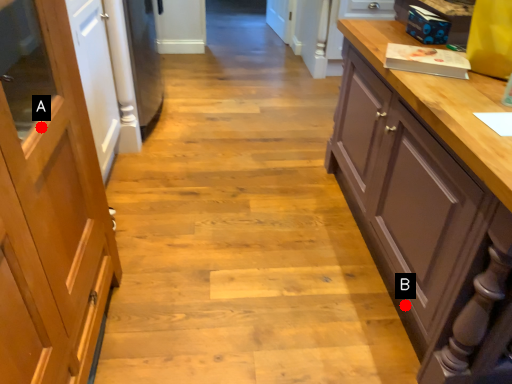
Question: Two points are circled on the image, labeled by A and B beside each circle. Which point is closer to the camera taking this photo?

Choices:
 (A) A is closer
 (B) B is closer

Answer: (A)